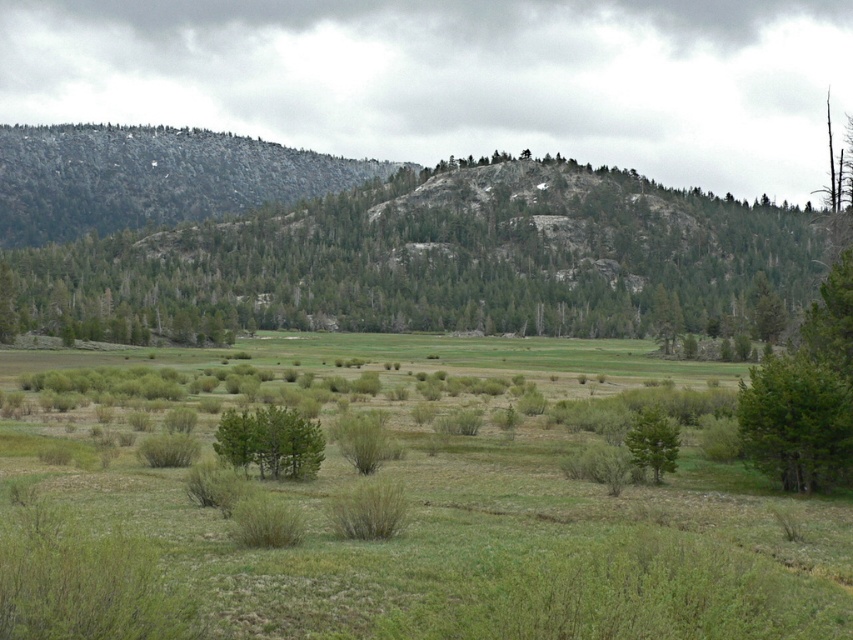
Question: Is rocky gray mountain at left bigger than green textured tree at lower right?

Choices:
 (A) yes
 (B) no

Answer: (A)

Question: Which point is closer to the camera taking this photo?

Choices:
 (A) (265, 416)
 (B) (660, 433)

Answer: (A)

Question: Does green leafy tree at upper center come behind green textured tree at lower right?

Choices:
 (A) no
 (B) yes

Answer: (B)

Question: In this image, where is green leafy tree at upper center located relative to green matte tree at center?

Choices:
 (A) below
 (B) above

Answer: (B)

Question: Among these points, which one is nearest to the camera?

Choices:
 (A) (254, 417)
 (B) (146, 205)

Answer: (A)

Question: Which of the following is the closest to the observer?

Choices:
 (A) (244, 451)
 (B) (653, 436)
 (C) (38, 209)

Answer: (A)